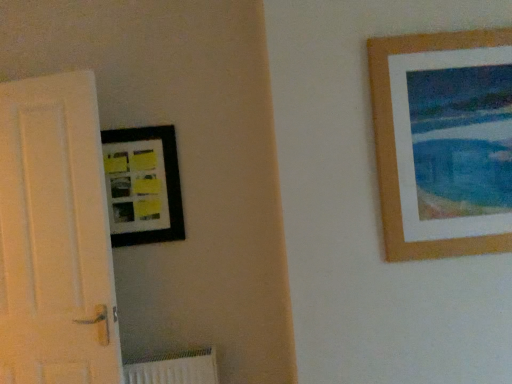
How much space does matte black picture frame at upper left, marked as the 2th picture frame in a right-to-left arrangement, occupy horizontally?

0.50 inches.

The image size is (512, 384). Identify the location of white matte door at left. (55, 237).

What are the coordinates of `door in front of the matte black picture frame at upper left, the 1th picture frame positioned from the back` in the screenshot? It's located at (55, 237).

Is point (36, 96) farther from viewer compared to point (177, 194)?

No, (36, 96) is in front of (177, 194).

What's the angular difference between wooden picture frame at upper right, which is counted as the first picture frame, starting from the front, and matte black picture frame at upper left, the 1th picture frame positioned from the back,'s facing directions?

wooden picture frame at upper right, which is counted as the first picture frame, starting from the front, and matte black picture frame at upper left, the 1th picture frame positioned from the back, are facing 0.686 degrees away from each other.

Is wooden picture frame at upper right, arranged as the 2th picture frame when viewed from the left, not close to matte black picture frame at upper left, the 1th picture frame positioned from the back?

Yes, wooden picture frame at upper right, arranged as the 2th picture frame when viewed from the left, is far from matte black picture frame at upper left, the 1th picture frame positioned from the back.

How much distance is there between wooden picture frame at upper right, arranged as the 2th picture frame when viewed from the left, and matte black picture frame at upper left, arranged as the second picture frame when viewed from the front?

A distance of 3.58 feet exists between wooden picture frame at upper right, arranged as the 2th picture frame when viewed from the left, and matte black picture frame at upper left, arranged as the second picture frame when viewed from the front.

From a real-world perspective, does wooden picture frame at upper right, arranged as the 2th picture frame when viewed from the left, sit lower than matte black picture frame at upper left, which is counted as the first picture frame, starting from the left?

No, from a real-world perspective, wooden picture frame at upper right, arranged as the 2th picture frame when viewed from the left, is not beneath matte black picture frame at upper left, which is counted as the first picture frame, starting from the left.

From the image's perspective, between matte black picture frame at upper left, marked as the 2th picture frame in a right-to-left arrangement, and white matte door at left, who is located below?

white matte door at left, from the image's perspective.

Is the position of matte black picture frame at upper left, which is counted as the first picture frame, starting from the left, less distant than that of white matte door at left?

No, the depth of matte black picture frame at upper left, which is counted as the first picture frame, starting from the left, is greater than that of white matte door at left.

In the scene shown: From a real-world perspective, between matte black picture frame at upper left, arranged as the second picture frame when viewed from the front, and white matte door at left, who is vertically lower?

white matte door at left, from a real-world perspective.

In the image, is matte black picture frame at upper left, arranged as the second picture frame when viewed from the front, on the left side or the right side of white matte door at left?

matte black picture frame at upper left, arranged as the second picture frame when viewed from the front, is positioned on white matte door at left's right side.

Does matte black picture frame at upper left, which is counted as the first picture frame, starting from the left, have a greater height compared to wooden picture frame at upper right, arranged as the second picture frame when viewed from the back?

No.

From the picture: Looking at their sizes, would you say matte black picture frame at upper left, the 1th picture frame positioned from the back, is wider or thinner than wooden picture frame at upper right, the 1th picture frame from the right?

Clearly, matte black picture frame at upper left, the 1th picture frame positioned from the back, has less width compared to wooden picture frame at upper right, the 1th picture frame from the right.

Does matte black picture frame at upper left, which is counted as the first picture frame, starting from the left, contain wooden picture frame at upper right, which is counted as the first picture frame, starting from the front?

No, matte black picture frame at upper left, which is counted as the first picture frame, starting from the left, does not contain wooden picture frame at upper right, which is counted as the first picture frame, starting from the front.

How different are the orientations of white matte door at left and wooden picture frame at upper right, which is counted as the first picture frame, starting from the front, in degrees?

9.06 degrees.

From the image's perspective, is white matte door at left under wooden picture frame at upper right, the 1th picture frame from the right?

Yes, from the image's perspective, white matte door at left is beneath wooden picture frame at upper right, the 1th picture frame from the right.

Is white matte door at left taller or shorter than wooden picture frame at upper right, arranged as the 2th picture frame when viewed from the left?

In the image, white matte door at left appears to be taller than wooden picture frame at upper right, arranged as the 2th picture frame when viewed from the left.

Considering the positions of point (42, 138) and point (423, 34), is point (42, 138) closer or farther from the camera than point (423, 34)?

Point (42, 138).

From the picture: Could you tell me if wooden picture frame at upper right, the 1th picture frame from the right, is facing white matte door at left?

No, wooden picture frame at upper right, the 1th picture frame from the right, is not oriented towards white matte door at left.

Based on the photo, are wooden picture frame at upper right, which is counted as the first picture frame, starting from the front, and white matte door at left beside each other?

wooden picture frame at upper right, which is counted as the first picture frame, starting from the front, and white matte door at left are not in contact.

How many degrees apart are the facing directions of wooden picture frame at upper right, arranged as the 2th picture frame when viewed from the left, and white matte door at left?

The facing directions of wooden picture frame at upper right, arranged as the 2th picture frame when viewed from the left, and white matte door at left are 9.06 degrees apart.

Is wooden picture frame at upper right, which is counted as the first picture frame, starting from the front, at the right side of white matte door at left?

Correct, you'll find wooden picture frame at upper right, which is counted as the first picture frame, starting from the front, to the right of white matte door at left.

Find the location of `door below the matte black picture frame at upper left, arranged as the second picture frame when viewed from the front (from a real-world perspective)`. door below the matte black picture frame at upper left, arranged as the second picture frame when viewed from the front (from a real-world perspective) is located at coordinates (55, 237).

This screenshot has width=512, height=384. What are the coordinates of `picture frame that is on the left side of wooden picture frame at upper right, arranged as the 2th picture frame when viewed from the left` in the screenshot? It's located at (143, 185).

In the scene shown: Considering their positions, is matte black picture frame at upper left, which is counted as the first picture frame, starting from the left, positioned closer to white matte door at left than wooden picture frame at upper right, the 1th picture frame from the right?

matte black picture frame at upper left, which is counted as the first picture frame, starting from the left, is closer to white matte door at left.

Considering their positions, is wooden picture frame at upper right, arranged as the 2th picture frame when viewed from the left, positioned further to white matte door at left than matte black picture frame at upper left, marked as the 2th picture frame in a right-to-left arrangement?

wooden picture frame at upper right, arranged as the 2th picture frame when viewed from the left, is further to white matte door at left.

When comparing their distances from matte black picture frame at upper left, arranged as the second picture frame when viewed from the front, does white matte door at left or wooden picture frame at upper right, arranged as the second picture frame when viewed from the back, seem closer?

white matte door at left is positioned closer to the anchor matte black picture frame at upper left, arranged as the second picture frame when viewed from the front.

Considering their positions, is wooden picture frame at upper right, which is counted as the first picture frame, starting from the front, positioned closer to matte black picture frame at upper left, the 1th picture frame positioned from the back, than white matte door at left?

white matte door at left lies closer to matte black picture frame at upper left, the 1th picture frame positioned from the back, than the other object.

When comparing their distances from wooden picture frame at upper right, the 1th picture frame from the right, does matte black picture frame at upper left, which is counted as the first picture frame, starting from the left, or white matte door at left seem closer?

matte black picture frame at upper left, which is counted as the first picture frame, starting from the left, is positioned closer to the anchor wooden picture frame at upper right, the 1th picture frame from the right.

From the image, which object appears to be farther from wooden picture frame at upper right, arranged as the second picture frame when viewed from the back, white matte door at left or matte black picture frame at upper left, marked as the 2th picture frame in a right-to-left arrangement?

white matte door at left is positioned further to the anchor wooden picture frame at upper right, arranged as the second picture frame when viewed from the back.

The image size is (512, 384). What are the coordinates of `picture frame between white matte door at left and wooden picture frame at upper right, the 1th picture frame from the right, in the horizontal direction` in the screenshot? It's located at (143, 185).